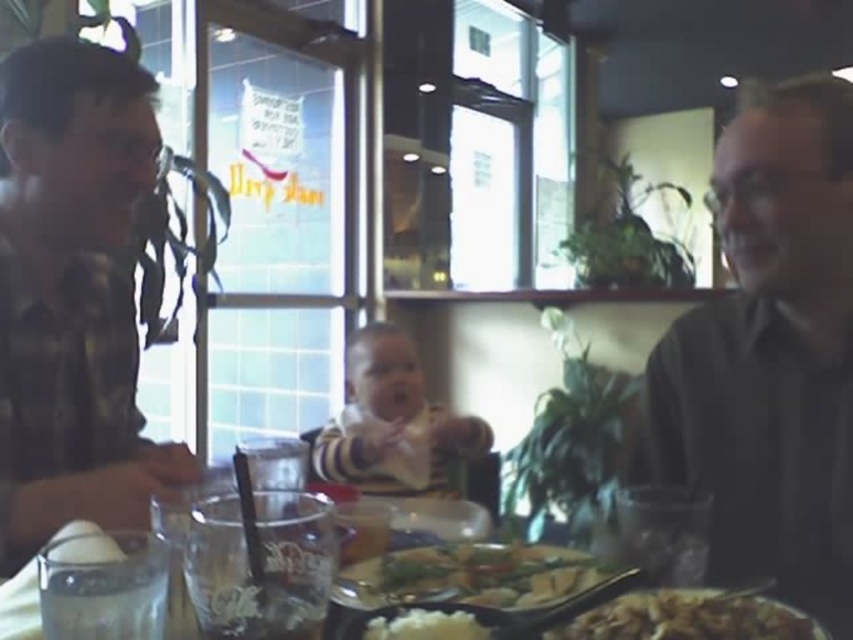
Is point (120, 336) positioned in front of point (488, 544)?

No.

Is plaid flannel shirt at left above shiny silver plate at center?

Yes, plaid flannel shirt at left is above shiny silver plate at center.

Is point (138, 212) closer to viewer compared to point (444, 579)?

That is False.

Where is `plaid flannel shirt at left`? The image size is (853, 640). plaid flannel shirt at left is located at coordinates (73, 294).

Which of these two, dark gray shirt at right or brown crispy fried rice at lower center, stands taller?

With more height is dark gray shirt at right.

Does dark gray shirt at right have a greater height compared to brown crispy fried rice at lower center?

Yes.

Locate an element on the screen. dark gray shirt at right is located at coordinates (770, 355).

Is shiny silver plate at center positioned before brown crispy fried rice at lower center?

No.

Who is positioned more to the left, shiny silver plate at center or brown crispy fried rice at lower center?

From the viewer's perspective, shiny silver plate at center appears more on the left side.

Describe the element at coordinates (482, 573) in the screenshot. The height and width of the screenshot is (640, 853). I see `shiny silver plate at center` at that location.

Locate an element on the screen. The height and width of the screenshot is (640, 853). shiny silver plate at center is located at coordinates (482, 573).